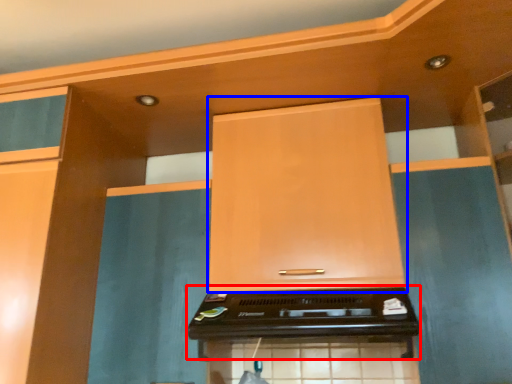
Question: Among these objects, which one is farthest to the camera, appliance (highlighted by a red box) or cabinetry (highlighted by a blue box)?

Choices:
 (A) appliance
 (B) cabinetry

Answer: (B)